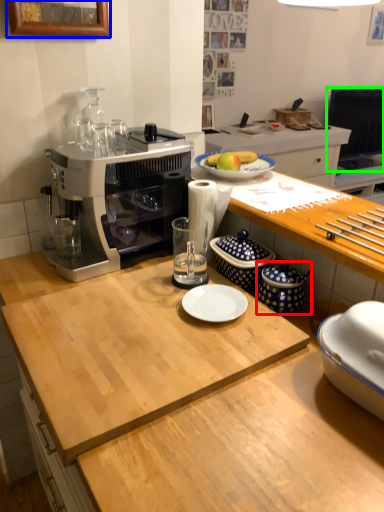
Question: Which is nearer to the appliance (highlighted by a red box)? picture frame (highlighted by a blue box) or television (highlighted by a green box).

Choices:
 (A) picture frame
 (B) television

Answer: (A)